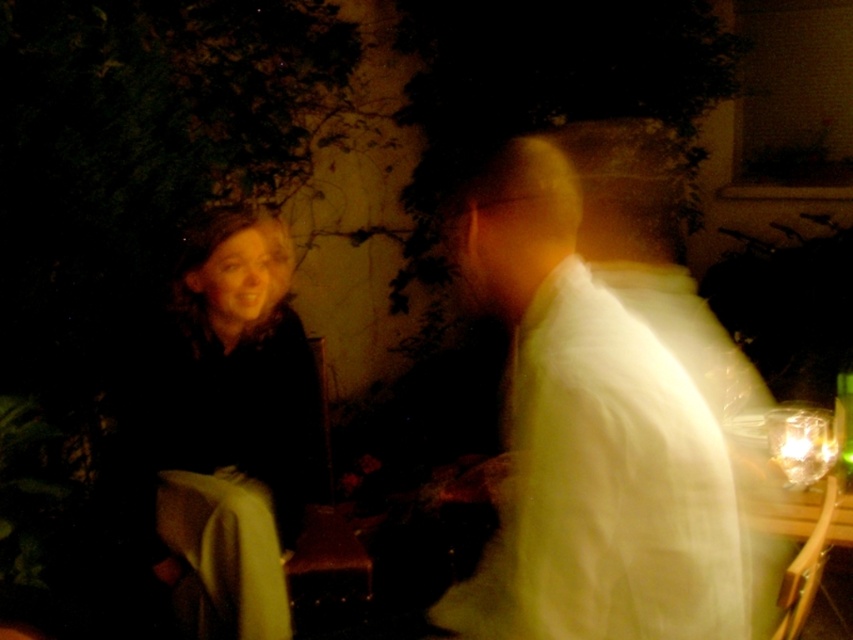
Question: Which object is positioned closest to the dark brown fabric coat at left?

Choices:
 (A) white glossy shirt at upper right
 (B) white matte shirt at center

Answer: (B)

Question: Can you confirm if white matte shirt at center is bigger than dark brown fabric coat at left?

Choices:
 (A) yes
 (B) no

Answer: (A)

Question: Can you confirm if white matte shirt at center is positioned above dark brown fabric coat at left?

Choices:
 (A) no
 (B) yes

Answer: (A)

Question: Does white matte shirt at center have a greater width compared to dark brown fabric coat at left?

Choices:
 (A) no
 (B) yes

Answer: (B)

Question: Estimate the real-world distances between objects in this image. Which object is closer to the white matte shirt at center?

Choices:
 (A) dark brown fabric coat at left
 (B) white glossy shirt at upper right

Answer: (A)

Question: Which object is the closest to the white matte shirt at center?

Choices:
 (A) dark brown fabric coat at left
 (B) white glossy shirt at upper right

Answer: (A)